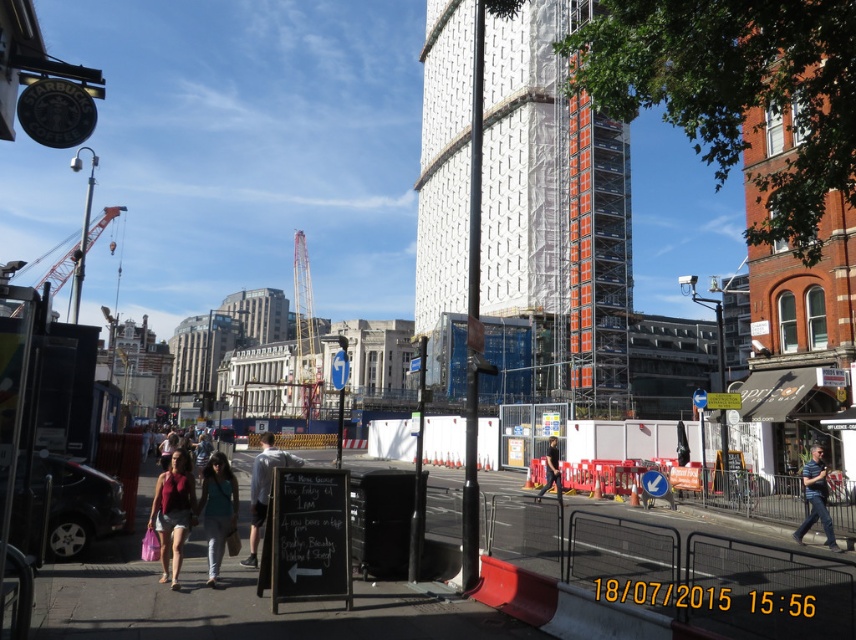
In the scene shown: You are standing on the sidewalk in the city scene and see the matte red top at center. If you want to reach it without crossing any barriers, can you walk directly to it?

The matte red top at center is 20.15 meters away from viewer. Since the construction site is fenced off with barriers and traffic cones, you cannot walk directly to it without crossing the barriers.

You are a fashion blogger observing two people in the city scene. You notice a person wearing denim pants at center and another wearing a light blue shirt at center. Which clothing item appears shorter in the image?

The denim pants at center has a lesser height compared to the light blue shirt at center, so the denim pants at center appears shorter.